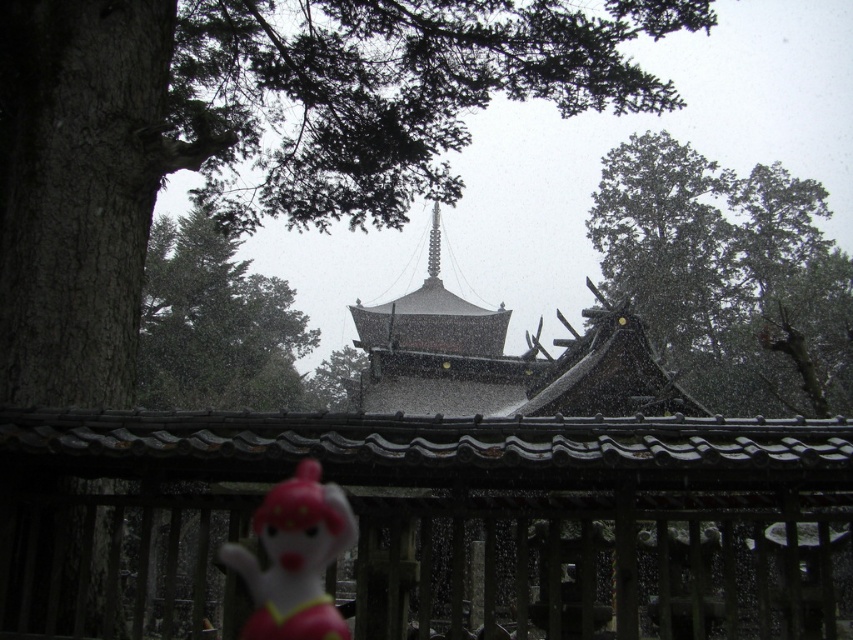
Question: Does green matte tree at upper right lie in front of pink rubber monkey at lower left?

Choices:
 (A) no
 (B) yes

Answer: (A)

Question: Based on their relative distances, which object is nearer to the green leafy tree at upper center?

Choices:
 (A) green matte tree at upper right
 (B) pink rubber monkey at lower left

Answer: (A)

Question: Is the position of green matte tree at upper right more distant than that of green leafy tree at upper center?

Choices:
 (A) yes
 (B) no

Answer: (A)

Question: Can you confirm if green leafy tree at upper center is thinner than pink rubber monkey at lower left?

Choices:
 (A) no
 (B) yes

Answer: (A)

Question: Which object is positioned farthest from the pink rubber monkey at lower left?

Choices:
 (A) green matte tree at upper right
 (B) green leafy tree at upper center

Answer: (A)

Question: Which point is farther to the camera?

Choices:
 (A) pink rubber monkey at lower left
 (B) green matte tree at upper right

Answer: (B)